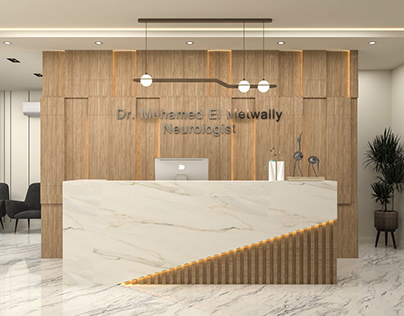
The image size is (404, 316). Identify the location of monitor. (185, 167).